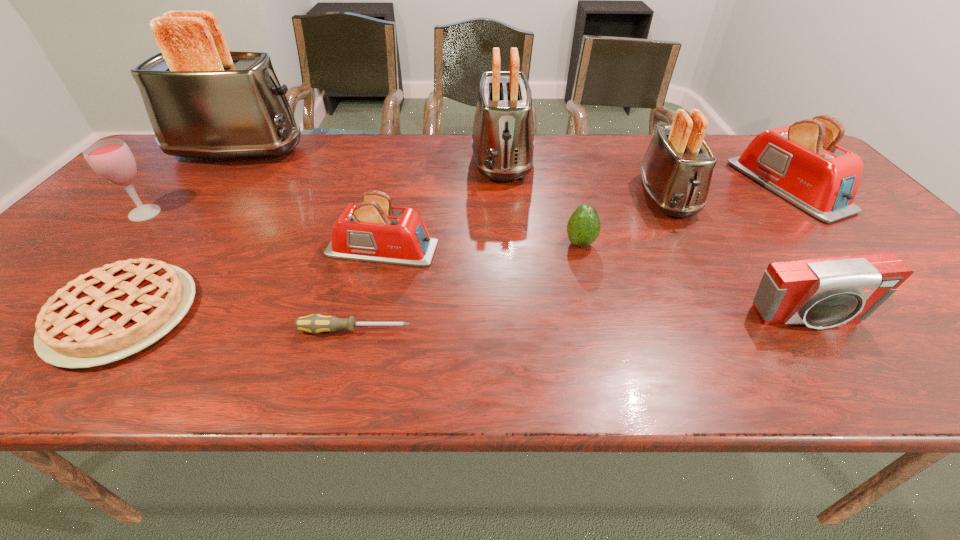
You are a GUI agent. You are given a task and a screenshot of the screen. Output one action in this format:
    pyautogui.click(x=<x>, y=<y>)
    Task: Click on the nearer red toaster
    The width and height of the screenshot is (960, 540).
    Given the screenshot: What is the action you would take?
    pyautogui.click(x=374, y=231)

Locate an element on the screen. This screenshot has width=960, height=540. camera is located at coordinates (822, 293).

Locate an element on the screen. This screenshot has width=960, height=540. the seventh object from left to right is located at coordinates (583, 227).

At what (x,y) coordinates should I click in order to perform the action: click on avocado. Please return your answer as a coordinate pair (x, y). This screenshot has height=540, width=960. Looking at the image, I should click on (583, 227).

Where is `the ninth tallest object`? the ninth tallest object is located at coordinates (114, 311).

Find the location of a particular element. tan pie is located at coordinates (114, 311).

Where is `the shortest object`? This screenshot has height=540, width=960. the shortest object is located at coordinates (316, 323).

Locate an element on the screen. screwdriver is located at coordinates (316, 323).

This screenshot has height=540, width=960. In order to click on free space located 0.050m on the side of the tallest toaster with the control lever in this screenshot , I will do `click(322, 152)`.

Locate an element on the screen. The image size is (960, 540). vacant space located on the side of the third toaster from right to left with the control lever is located at coordinates (507, 220).